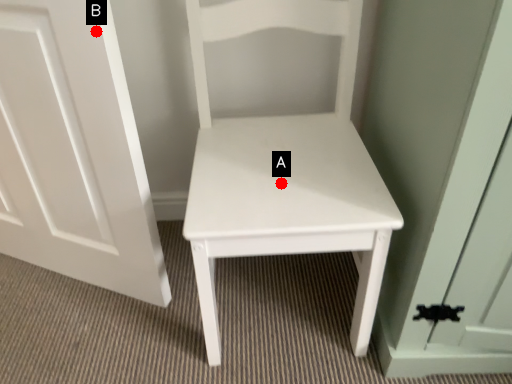
Question: Two points are circled on the image, labeled by A and B beside each circle. Which point is farther to the camera?

Choices:
 (A) A is further
 (B) B is further

Answer: (A)